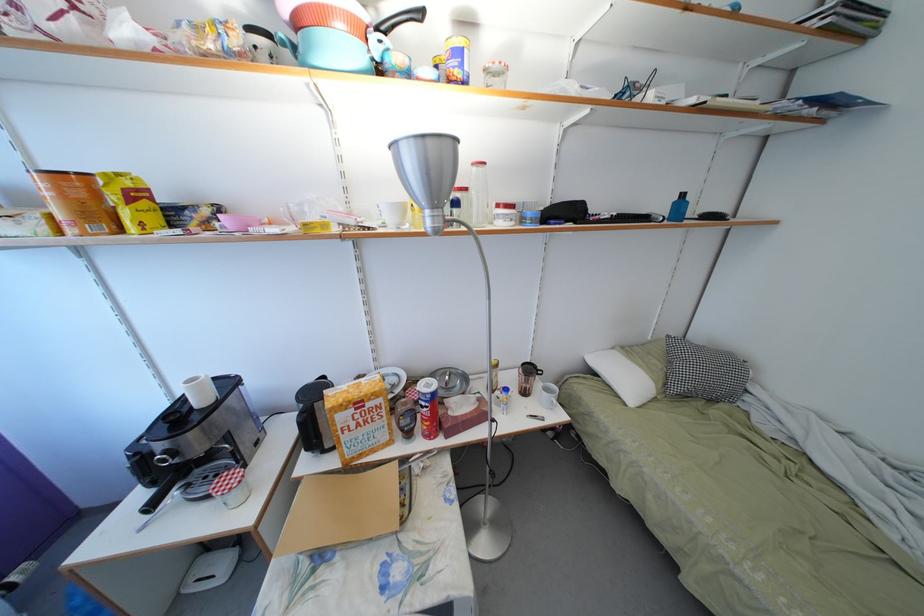
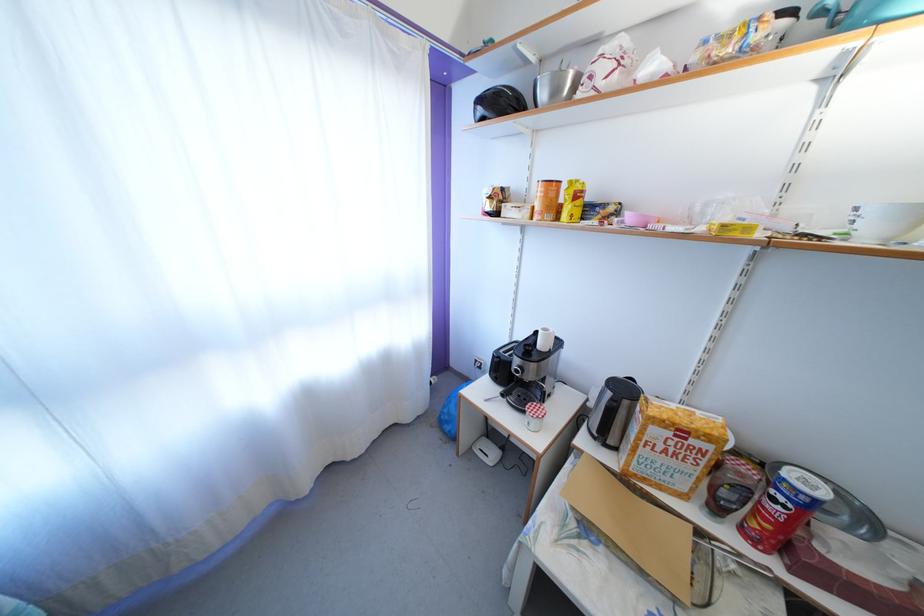
Find the pixel in the second image that matches point 439,400 in the first image.

(821, 508)